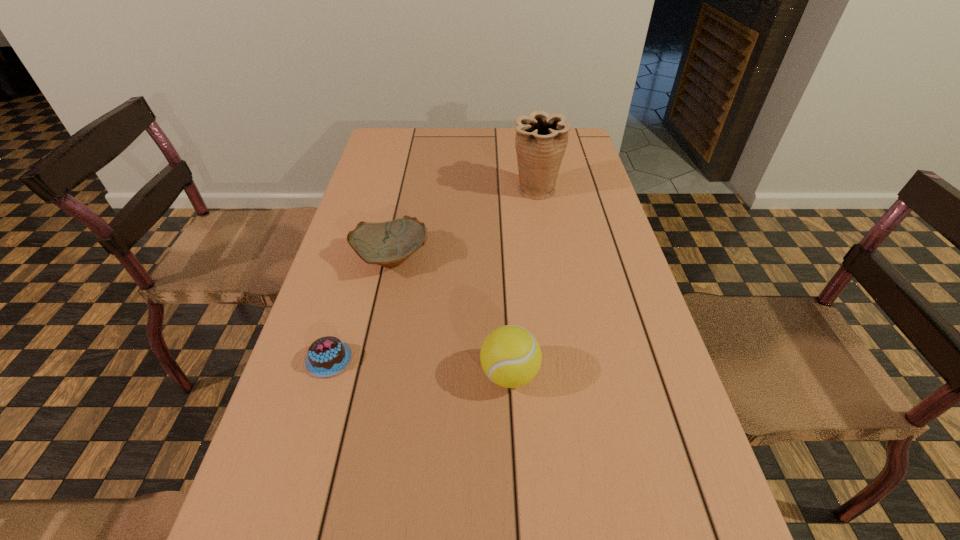
Where is `the tallest object`? The width and height of the screenshot is (960, 540). the tallest object is located at coordinates (541, 139).

You are a GUI agent. You are given a task and a screenshot of the screen. Output one action in this format:
    pyautogui.click(x=<x>, y=<y>)
    Task: Click on the urn
    This screenshot has width=960, height=540.
    Given the screenshot: What is the action you would take?
    pyautogui.click(x=541, y=139)

Where is `the second tallest object`? This screenshot has width=960, height=540. the second tallest object is located at coordinates (510, 356).

Locate an element on the screen. the second shortest object is located at coordinates (389, 244).

The image size is (960, 540). In order to click on pottery in this screenshot , I will do `click(389, 244)`.

This screenshot has width=960, height=540. Find the location of `chocolate cake`. chocolate cake is located at coordinates (327, 356).

At what (x,y) coordinates should I click in order to perform the action: click on free location located 0.110m on the left of the urn. Please return your answer as a coordinate pair (x, y). This screenshot has height=540, width=960. Looking at the image, I should click on (475, 191).

Identify the location of vacant space located on the left of the third shortest object. (314, 374).

Image resolution: width=960 pixels, height=540 pixels. What are the coordinates of `free space located on the front of the second shortest object` in the screenshot? It's located at (366, 377).

Image resolution: width=960 pixels, height=540 pixels. I want to click on free space located on the front of the shortest object, so click(276, 538).